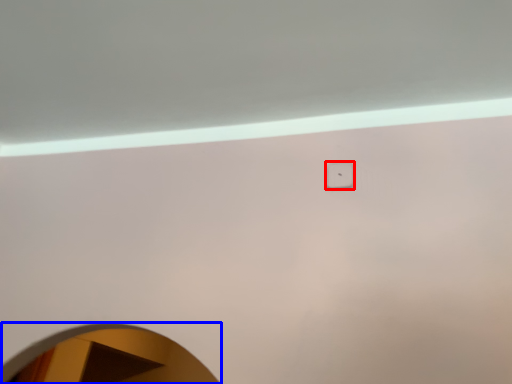
Question: Which of the following is the farthest to the observer, light switch (highlighted by a red box) or mirror (highlighted by a blue box)?

Choices:
 (A) light switch
 (B) mirror

Answer: (A)